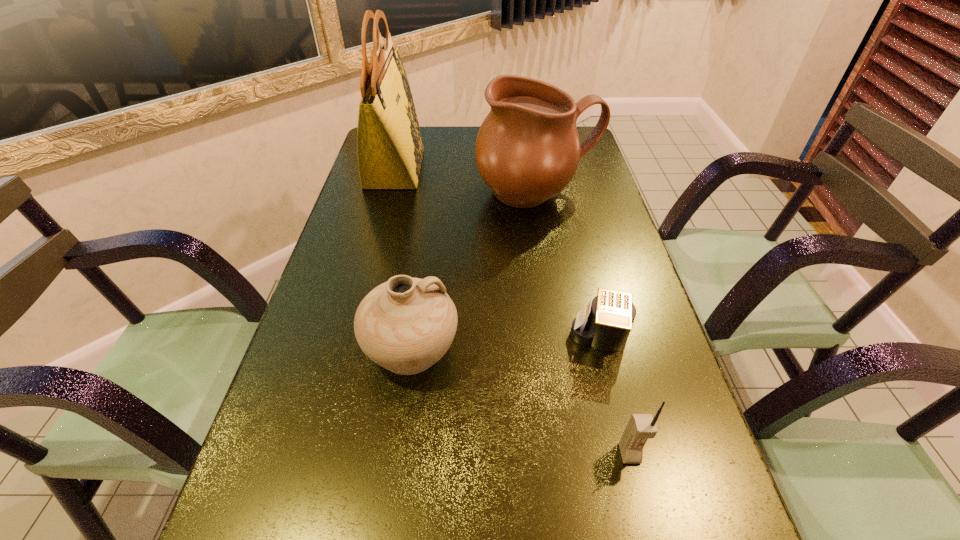
Where is `object that is positioned at the far edge`? The height and width of the screenshot is (540, 960). object that is positioned at the far edge is located at coordinates (390, 150).

Where is `tote bag located at the left edge`? Image resolution: width=960 pixels, height=540 pixels. tote bag located at the left edge is located at coordinates (390, 150).

Image resolution: width=960 pixels, height=540 pixels. Find the location of `pottery that is positioned at the left edge`. pottery that is positioned at the left edge is located at coordinates (405, 325).

Where is `cream pitcher located in the right edge section of the desktop`? The height and width of the screenshot is (540, 960). cream pitcher located in the right edge section of the desktop is located at coordinates coord(527,150).

You are a GUI agent. You are given a task and a screenshot of the screen. Output one action in this format:
    pyautogui.click(x=<x>, y=<y>)
    Task: Click on the cellular telephone located in the right edge section of the desktop
    The width and height of the screenshot is (960, 540).
    Given the screenshot: What is the action you would take?
    pyautogui.click(x=640, y=427)

Identify the location of calculator located at the right edge. Image resolution: width=960 pixels, height=540 pixels. (605, 323).

Find the location of a particular element. object that is at the far left corner is located at coordinates (390, 150).

In order to click on vacant space at the left edge of the desktop in this screenshot , I will do `click(355, 384)`.

Identify the location of vacant space at the right edge of the desktop. (643, 311).

Image resolution: width=960 pixels, height=540 pixels. In order to click on vacant space at the far right corner in this screenshot , I will do `click(577, 127)`.